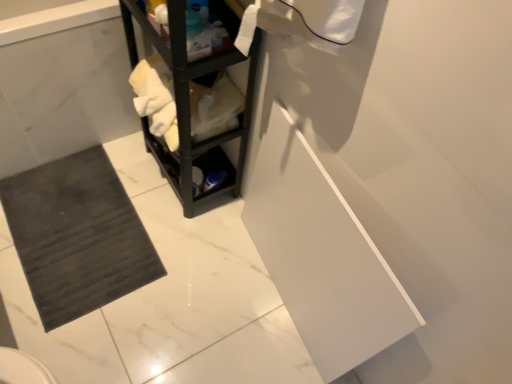
Find the location of a particular element. The image size is (512, 384). free space above dark gray rubber bath mat at lower left (from a real-world perspective) is located at coordinates (76, 230).